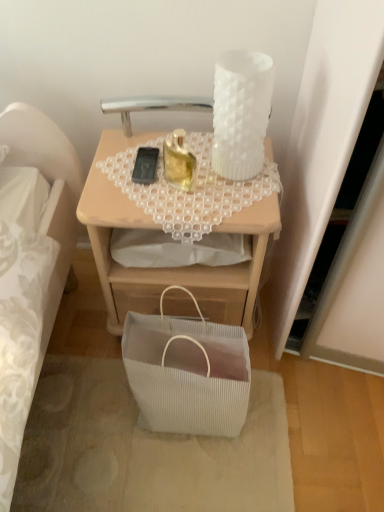
This screenshot has width=384, height=512. What are the coordinates of `vacant area that is situated to the right of black matte mobile phone at center` in the screenshot? It's located at (212, 170).